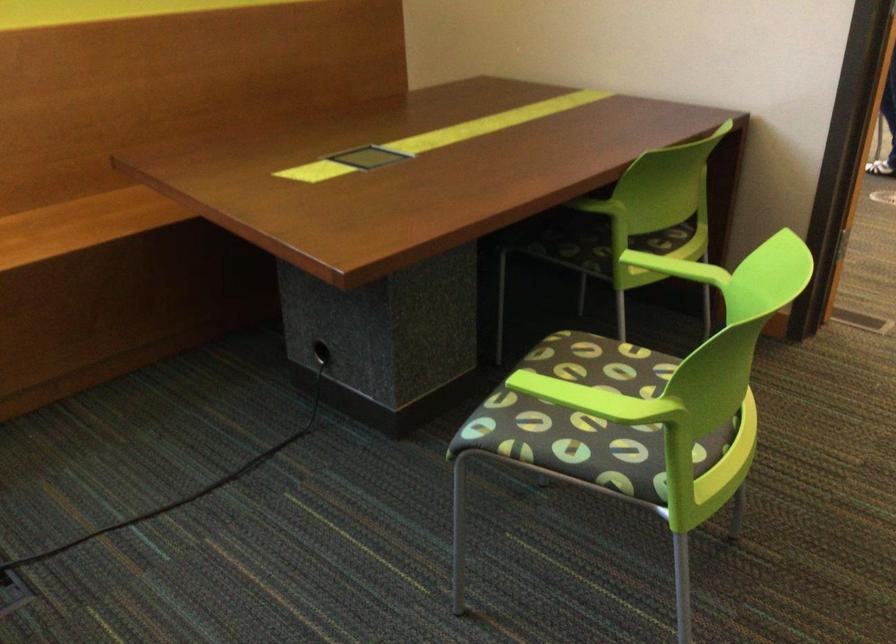
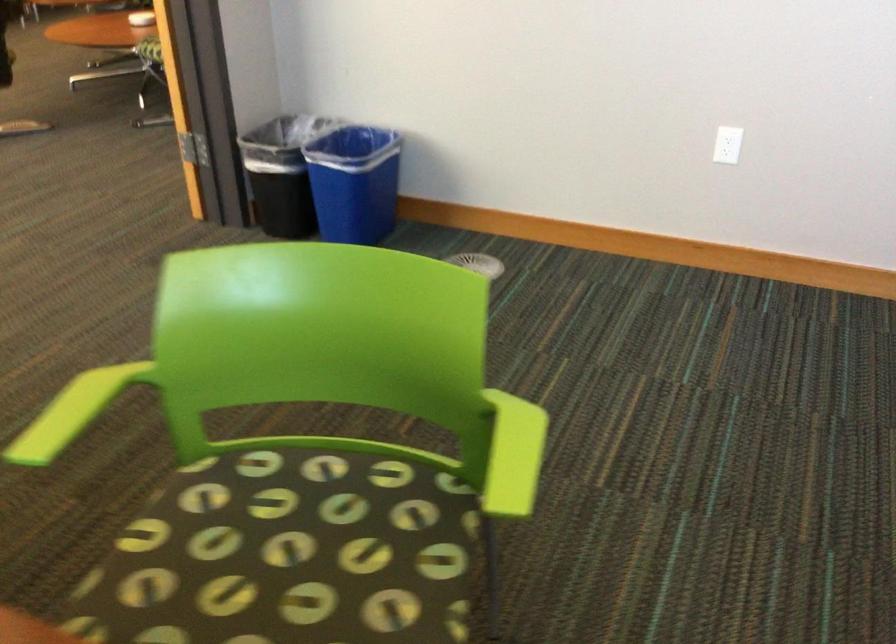
In the second image, find the point that corresponds to (587,399) in the first image.

(513, 455)